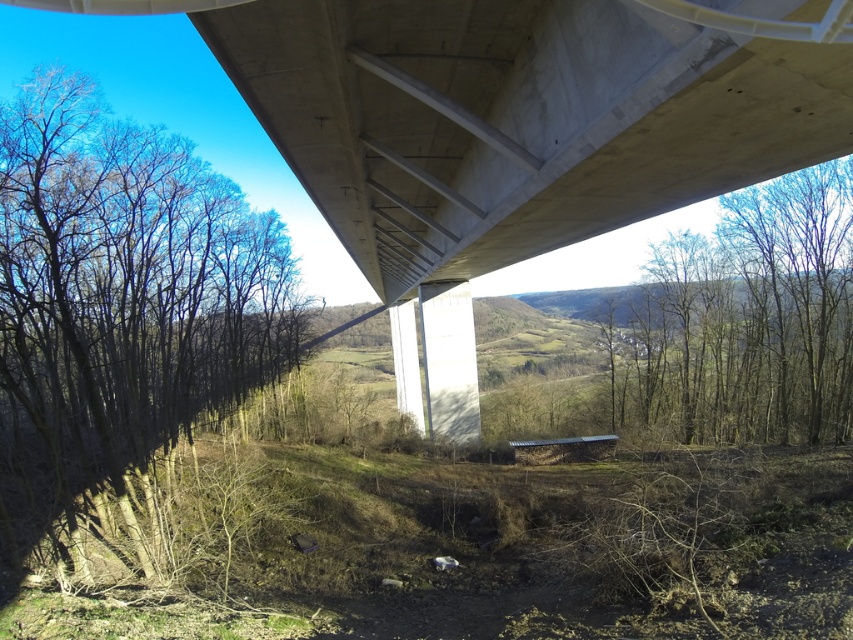
Is concrete at upper center positioned in front of bare wood trees at upper right?

Yes, it is.

Who is lower down, concrete at upper center or bare wood trees at upper right?

concrete at upper center is below.

What are the coordinates of `concrete at upper center` in the screenshot? It's located at point(515,129).

Who is more forward, (109, 499) or (606, 301)?

Point (109, 499)

Which is behind, point (88, 84) or point (618, 296)?

Positioned behind is point (618, 296).

Is point (268, 324) positioned before point (724, 216)?

No, it is not.

I want to click on bare branches at left, so click(x=120, y=312).

The height and width of the screenshot is (640, 853). Describe the element at coordinates (515, 129) in the screenshot. I see `concrete at upper center` at that location.

Is point (798, 42) less distant than point (28, 115)?

Yes, point (798, 42) is closer to viewer.

Does point (485, 195) come closer to viewer compared to point (55, 540)?

No, (485, 195) is further to viewer.

Find the location of a particular element. The height and width of the screenshot is (640, 853). concrete at upper center is located at coordinates (515, 129).